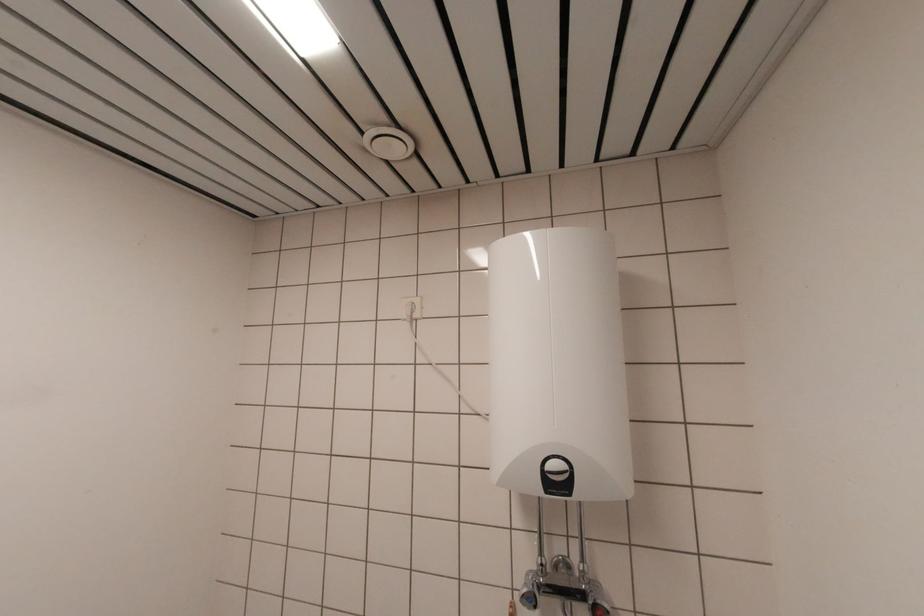
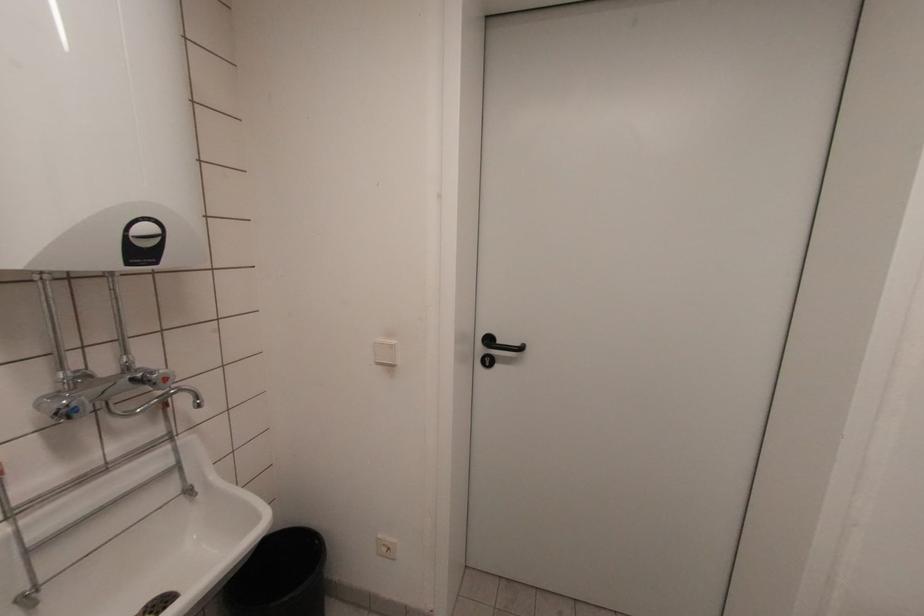
Find the pixel in the second image that matches point (564, 493) in the first image.

(151, 261)